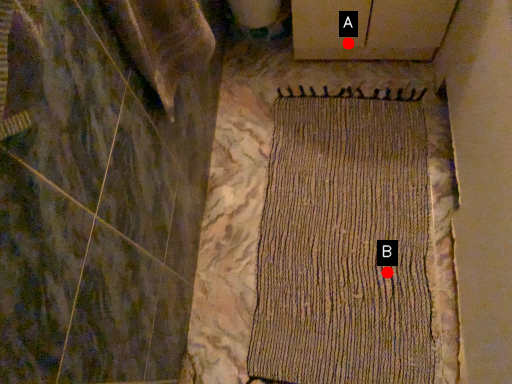
Question: Two points are circled on the image, labeled by A and B beside each circle. Which of the following is the closest to the observer?

Choices:
 (A) A is closer
 (B) B is closer

Answer: (B)